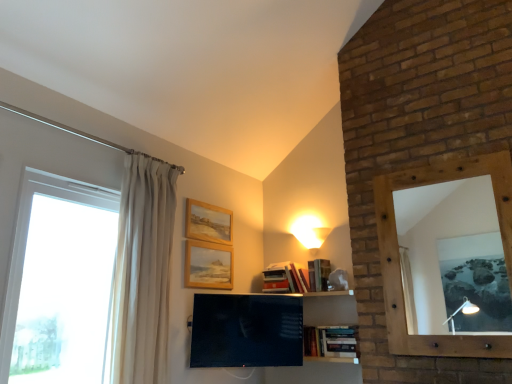
Where is `white glass window at left`? The width and height of the screenshot is (512, 384). white glass window at left is located at coordinates [x=61, y=291].

What do you see at coordinates (208, 265) in the screenshot? I see `wooden picture frame at upper center, which appears as the second picture frame when viewed from the top` at bounding box center [208, 265].

What is the approximate width of matte black tv at center?

It is 3.42 inches.

The width and height of the screenshot is (512, 384). What do you see at coordinates (331, 341) in the screenshot?
I see `hardcover books at center` at bounding box center [331, 341].

This screenshot has height=384, width=512. I want to click on wooden-framed mirror at right, so click(x=453, y=258).

Locate an element on the screen. This screenshot has height=384, width=512. white sheer curtain at left is located at coordinates (142, 272).

Is wooden picture frame at upper center, the 1th picture frame positioned from the bottom, facing towards matte black tv at center?

No, wooden picture frame at upper center, the 1th picture frame positioned from the bottom, is not oriented towards matte black tv at center.

Can you confirm if wooden picture frame at upper center, which appears as the second picture frame when viewed from the top, is thinner than matte black tv at center?

Yes, wooden picture frame at upper center, which appears as the second picture frame when viewed from the top, is thinner than matte black tv at center.

Is point (218, 244) positioned in front of point (226, 305)?

No, it is behind (226, 305).

Could you tell me if white glass window at left is facing white sheer curtain at left?

No, white glass window at left is not facing towards white sheer curtain at left.

Considering the sizes of objects white glass window at left and white sheer curtain at left in the image provided, who is thinner, white glass window at left or white sheer curtain at left?

Thinner between the two is white glass window at left.

I want to click on window lying on the left of white sheer curtain at left, so click(61, 291).

Is white glass window at left further to camera compared to white sheer curtain at left?

No, it is not.

From a real-world perspective, who is located higher, wooden-framed mirror at right or matte white lampshade at upper center?

matte white lampshade at upper center, from a real-world perspective.

From the image's perspective, is wooden-framed mirror at right under matte white lampshade at upper center?

No, from the image's perspective, wooden-framed mirror at right is not beneath matte white lampshade at upper center.

Is wooden-framed mirror at right directly adjacent to matte white lampshade at upper center?

There is a gap between wooden-framed mirror at right and matte white lampshade at upper center.

The width and height of the screenshot is (512, 384). In order to click on mirror in front of the matte white lampshade at upper center in this screenshot , I will do `click(453, 258)`.

Where is `book located underneath the white sheer curtain at left (from a real-world perspective)`? Image resolution: width=512 pixels, height=384 pixels. book located underneath the white sheer curtain at left (from a real-world perspective) is located at coordinates [331, 341].

Is white sheer curtain at left not near hardcover books at center?

Yes, white sheer curtain at left is far from hardcover books at center.

Does white sheer curtain at left appear on the left side of hardcover books at center?

Indeed, white sheer curtain at left is positioned on the left side of hardcover books at center.

Which is closer, (169, 233) or (307, 355)?

Point (169, 233)

Does white glass window at left come behind matte white lampshade at upper center?

No, white glass window at left is closer to the viewer.

Is white glass window at left turned away from matte white lampshade at upper center?

No, white glass window at left is not facing the opposite direction of matte white lampshade at upper center.

How distant is white glass window at left from matte white lampshade at upper center?

white glass window at left is 1.80 meters from matte white lampshade at upper center.

How many degrees apart are the facing directions of white glass window at left and matte white lampshade at upper center?

They differ by 90 degrees in their facing directions.

This screenshot has height=384, width=512. What are the coordinates of `the 1st picture frame above the white glass window at left (from a real-world perspective)` in the screenshot? It's located at (208, 265).

Between white glass window at left and wooden picture frame at upper center, the 1th picture frame positioned from the bottom, which one has larger size?

With larger size is white glass window at left.

From the image's perspective, relative to wooden picture frame at upper center, the 1th picture frame positioned from the bottom, is white glass window at left above or below?

white glass window at left is above wooden picture frame at upper center, the 1th picture frame positioned from the bottom.

Does white glass window at left have a greater width compared to wooden picture frame at upper center, the 1th picture frame positioned from the bottom?

Correct, the width of white glass window at left exceeds that of wooden picture frame at upper center, the 1th picture frame positioned from the bottom.

Is the depth of white sheer curtain at left greater than that of matte white lampshade at upper center?

No, white sheer curtain at left is closer to the camera.

Between white sheer curtain at left and matte white lampshade at upper center, which one has smaller width?

matte white lampshade at upper center.

Is white sheer curtain at left in contact with matte white lampshade at upper center?

No, white sheer curtain at left is not making contact with matte white lampshade at upper center.

Is white sheer curtain at left oriented away from matte white lampshade at upper center?

white sheer curtain at left does not have its back to matte white lampshade at upper center.

Locate an element on the screen. picture frame that is the 1st object to the left of the matte black tv at center, starting at the anchor is located at coordinates (208, 265).

Image resolution: width=512 pixels, height=384 pixels. Identify the location of window that is under the white sheer curtain at left (from a real-world perspective). (61, 291).

Looking at the image, which one is located closer to hardcover books at center, wooden picture frame at upper center, which appears as the second picture frame when viewed from the top, or wooden-framed mirror at right?

The object closer to hardcover books at center is wooden picture frame at upper center, which appears as the second picture frame when viewed from the top.

Looking at the image, which one is located closer to hardcover books at center, white sheer curtain at left or matte black tv at center?

matte black tv at center.

Based on their spatial positions, is wooden picture frame at upper center, arranged as the second picture frame when ordered from the bottom, or wooden picture frame at upper center, the 1th picture frame positioned from the bottom, further from white sheer curtain at left?

wooden picture frame at upper center, arranged as the second picture frame when ordered from the bottom, lies further to white sheer curtain at left than the other object.

Which object lies further to the anchor point wooden-framed mirror at right, white sheer curtain at left or hardcover books at center?

white sheer curtain at left is further to wooden-framed mirror at right.

Estimate the real-world distances between objects in this image. Which object is closer to wooden-framed mirror at right, wooden picture frame at upper center, arranged as the second picture frame when ordered from the bottom, or white glass window at left?

Based on the image, wooden picture frame at upper center, arranged as the second picture frame when ordered from the bottom, appears to be nearer to wooden-framed mirror at right.

Based on their spatial positions, is matte white lampshade at upper center or white sheer curtain at left further from wooden picture frame at upper center, which appears as the first picture frame when viewed from the top?

Among the two, matte white lampshade at upper center is located further to wooden picture frame at upper center, which appears as the first picture frame when viewed from the top.

When comparing their distances from white sheer curtain at left, does hardcover books at center or wooden-framed mirror at right seem further?

Among the two, wooden-framed mirror at right is located further to white sheer curtain at left.

Considering their positions, is hardcover books at center positioned further to wooden picture frame at upper center, arranged as the second picture frame when ordered from the bottom, than white sheer curtain at left?

hardcover books at center lies further to wooden picture frame at upper center, arranged as the second picture frame when ordered from the bottom, than the other object.

Locate an element on the screen. television between white sheer curtain at left and wooden picture frame at upper center, which appears as the first picture frame when viewed from the top, along the z-axis is located at coordinates (246, 331).

Where is `television between wooden picture frame at upper center, the 1th picture frame positioned from the bottom, and hardcover books at center`? television between wooden picture frame at upper center, the 1th picture frame positioned from the bottom, and hardcover books at center is located at coordinates (246, 331).

At what (x,y) coordinates should I click in order to perform the action: click on book between wooden-framed mirror at right and matte white lampshade at upper center from front to back. Please return your answer as a coordinate pair (x, y). The height and width of the screenshot is (384, 512). Looking at the image, I should click on (331, 341).

I want to click on curtain located between white glass window at left and hardcover books at center in the left-right direction, so click(142, 272).